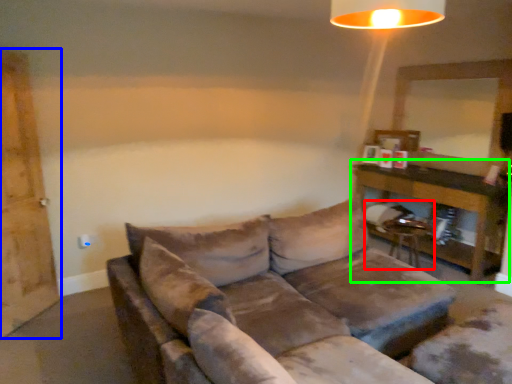
Question: Which is farther away from swivel chair (highlighted by a red box)? barn door (highlighted by a blue box) or table (highlighted by a green box)?

Choices:
 (A) barn door
 (B) table

Answer: (A)